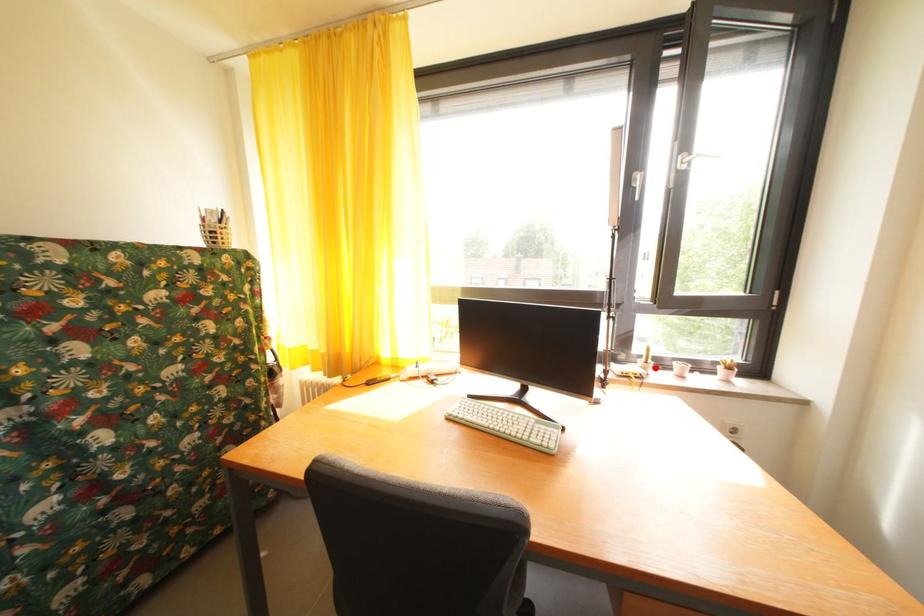
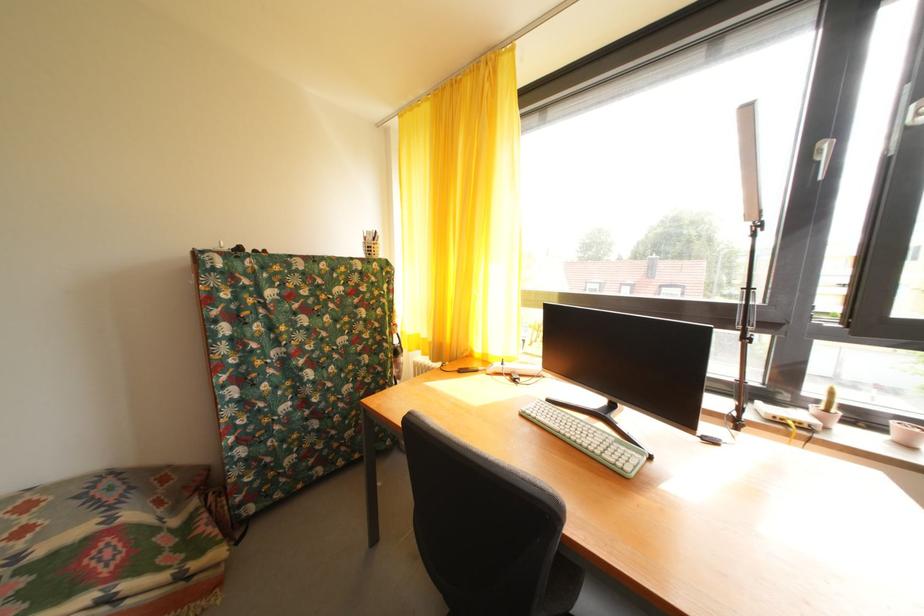
Find the pixel in the second image that matches the highlighted location in the first image.

(836, 416)